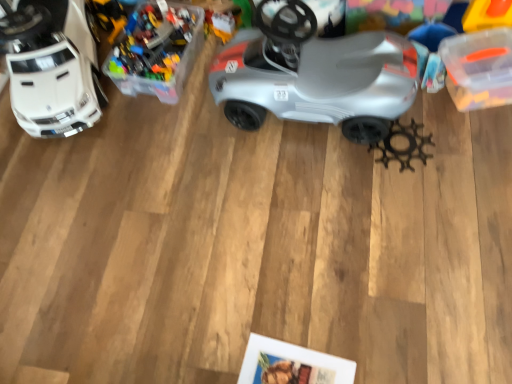
What do you see at coordinates (52, 67) in the screenshot? This screenshot has width=512, height=384. I see `white plastic car at left, the 3th toy in the right-to-left sequence` at bounding box center [52, 67].

What is the approximate height of silver matte car at center?

silver matte car at center is 18.83 inches in height.

The width and height of the screenshot is (512, 384). What do you see at coordinates (157, 51) in the screenshot?
I see `translucent plastic container at upper left, acting as the second toy starting from the left` at bounding box center [157, 51].

Locate an element on the screen. metallic gear at lower right, which is the 1th toy in right-to-left order is located at coordinates (406, 147).

Locate an element on the screen. The width and height of the screenshot is (512, 384). white plastic car at left, the 1th toy when ordered from left to right is located at coordinates (52, 67).

Which is in front, point (180, 70) or point (242, 68)?

Point (242, 68)

This screenshot has height=384, width=512. Identify the location of car above the translucent plastic container at upper left, the 2th toy positioned from the right (from a real-world perspective). [315, 74].

In terms of height, does translucent plastic container at upper left, acting as the second toy starting from the left, look taller or shorter compared to silver matte car at center?

In the image, translucent plastic container at upper left, acting as the second toy starting from the left, appears to be shorter than silver matte car at center.

Who is more distant, translucent plastic container at upper left, the 2th toy positioned from the right, or silver matte car at center?

translucent plastic container at upper left, the 2th toy positioned from the right, is further away from the camera.

Considering the relative positions of translucent plastic container at upper left, the 2th toy positioned from the right, and white plastic car at left, the 3th toy in the right-to-left sequence, in the image provided, is translucent plastic container at upper left, the 2th toy positioned from the right, behind white plastic car at left, the 3th toy in the right-to-left sequence,?

Yes.

Is translucent plastic container at upper left, acting as the second toy starting from the left, oriented away from white plastic car at left, the 3th toy in the right-to-left sequence?

translucent plastic container at upper left, acting as the second toy starting from the left, does not have its back to white plastic car at left, the 3th toy in the right-to-left sequence.

Is translucent plastic container at upper left, the 2th toy positioned from the right, placed right next to white plastic car at left, the 3th toy in the right-to-left sequence?

They are not placed beside each other.

From the picture: Considering the relative sizes of white plastic car at left, the 3th toy in the right-to-left sequence, and translucent plastic container at upper left, acting as the second toy starting from the left, in the image provided, is white plastic car at left, the 3th toy in the right-to-left sequence, shorter than translucent plastic container at upper left, acting as the second toy starting from the left,?

No.

From the image's perspective, who appears lower, white plastic car at left, the 1th toy when ordered from left to right, or translucent plastic container at upper left, acting as the second toy starting from the left?

From the image's view, white plastic car at left, the 1th toy when ordered from left to right, is below.

How different are the orientations of white plastic car at left, the 1th toy when ordered from left to right, and translucent plastic container at upper left, acting as the second toy starting from the left, in degrees?

21.9 degrees separate the facing orientations of white plastic car at left, the 1th toy when ordered from left to right, and translucent plastic container at upper left, acting as the second toy starting from the left.

How far apart are white plastic car at left, the 3th toy in the right-to-left sequence, and translucent plastic container at upper left, the 2th toy positioned from the right?

white plastic car at left, the 3th toy in the right-to-left sequence, is 9.90 inches away from translucent plastic container at upper left, the 2th toy positioned from the right.

Which object is positioned more to the right, white plastic car at left, the 1th toy when ordered from left to right, or metallic gear at lower right, which is the 1th toy in right-to-left order?

metallic gear at lower right, which is the 1th toy in right-to-left order.

Would you say white plastic car at left, the 3th toy in the right-to-left sequence, is outside metallic gear at lower right, the 3th toy viewed from the left?

Absolutely, white plastic car at left, the 3th toy in the right-to-left sequence, is external to metallic gear at lower right, the 3th toy viewed from the left.

Is white plastic car at left, the 1th toy when ordered from left to right, beside metallic gear at lower right, which is the 1th toy in right-to-left order?

No, white plastic car at left, the 1th toy when ordered from left to right, is not making contact with metallic gear at lower right, which is the 1th toy in right-to-left order.

Considering the points (55, 84) and (385, 151), which point is in front, point (55, 84) or point (385, 151)?

The point (55, 84) is in front.

From a real-world perspective, which toy is the 1st one above the metallic gear at lower right, the 3th toy viewed from the left? Please provide its 2D coordinates.

[(157, 51)]

Which object is thinner, translucent plastic container at upper left, the 2th toy positioned from the right, or metallic gear at lower right, which is the 1th toy in right-to-left order?

With smaller width is metallic gear at lower right, which is the 1th toy in right-to-left order.

From the image's perspective, does translucent plastic container at upper left, acting as the second toy starting from the left, appear higher than metallic gear at lower right, the 3th toy viewed from the left?

Correct, translucent plastic container at upper left, acting as the second toy starting from the left, appears higher than metallic gear at lower right, the 3th toy viewed from the left, in the image.

Looking at this image, from a real-world perspective, is translucent plastic container at upper left, acting as the second toy starting from the left, on metallic gear at lower right, the 3th toy viewed from the left?

Yes, from a real-world perspective, translucent plastic container at upper left, acting as the second toy starting from the left, is above metallic gear at lower right, the 3th toy viewed from the left.

From a real-world perspective, between metallic gear at lower right, which is the 1th toy in right-to-left order, and translucent plastic container at upper left, acting as the second toy starting from the left, who is vertically higher?

translucent plastic container at upper left, acting as the second toy starting from the left, from a real-world perspective.

Find the location of a particular element. toy that is the 2nd one when counting upward from the metallic gear at lower right, the 3th toy viewed from the left (from the image's perspective) is located at coordinates (157, 51).

Can you confirm if metallic gear at lower right, the 3th toy viewed from the left, is shorter than translucent plastic container at upper left, acting as the second toy starting from the left?

Yes.

How many degrees apart are the facing directions of metallic gear at lower right, which is the 1th toy in right-to-left order, and translucent plastic container at upper left, the 2th toy positioned from the right?

7.84e-05 degrees separate the facing orientations of metallic gear at lower right, which is the 1th toy in right-to-left order, and translucent plastic container at upper left, the 2th toy positioned from the right.

From a real-world perspective, is silver matte car at center positioned under white plastic car at left, the 3th toy in the right-to-left sequence, based on gravity?

Indeed, from a real-world perspective, silver matte car at center is positioned beneath white plastic car at left, the 3th toy in the right-to-left sequence.

Between point (409, 48) and point (53, 81), which one is positioned in front?

The point (409, 48) is closer.

Is silver matte car at center positioned beyond the bounds of white plastic car at left, the 3th toy in the right-to-left sequence?

That's correct, silver matte car at center is outside of white plastic car at left, the 3th toy in the right-to-left sequence.

Where is `the 2nd toy behind the silver matte car at center, starting your count from the anchor`? the 2nd toy behind the silver matte car at center, starting your count from the anchor is located at coordinates (157, 51).

The image size is (512, 384). In order to click on toy in front of the translucent plastic container at upper left, acting as the second toy starting from the left in this screenshot , I will do coord(52,67).

Based on their spatial positions, is white plastic car at left, the 1th toy when ordered from left to right, or metallic gear at lower right, which is the 1th toy in right-to-left order, further from silver matte car at center?

Based on the image, white plastic car at left, the 1th toy when ordered from left to right, appears to be further to silver matte car at center.

Which object lies further to the anchor point white plastic car at left, the 3th toy in the right-to-left sequence, silver matte car at center or metallic gear at lower right, the 3th toy viewed from the left?

metallic gear at lower right, the 3th toy viewed from the left, is further to white plastic car at left, the 3th toy in the right-to-left sequence.

Which object lies nearer to the anchor point translucent plastic container at upper left, the 2th toy positioned from the right, silver matte car at center or white plastic car at left, the 1th toy when ordered from left to right?

The object closer to translucent plastic container at upper left, the 2th toy positioned from the right, is white plastic car at left, the 1th toy when ordered from left to right.

Considering their positions, is metallic gear at lower right, which is the 1th toy in right-to-left order, positioned further to silver matte car at center than translucent plastic container at upper left, the 2th toy positioned from the right?

translucent plastic container at upper left, the 2th toy positioned from the right, is positioned further to the anchor silver matte car at center.

Estimate the real-world distances between objects in this image. Which object is closer to translucent plastic container at upper left, acting as the second toy starting from the left, white plastic car at left, the 1th toy when ordered from left to right, or silver matte car at center?

Based on the image, white plastic car at left, the 1th toy when ordered from left to right, appears to be nearer to translucent plastic container at upper left, acting as the second toy starting from the left.

Looking at the image, which one is located further to silver matte car at center, white plastic car at left, the 3th toy in the right-to-left sequence, or translucent plastic container at upper left, acting as the second toy starting from the left?

Based on the image, white plastic car at left, the 3th toy in the right-to-left sequence, appears to be further to silver matte car at center.

Estimate the real-world distances between objects in this image. Which object is further from metallic gear at lower right, the 3th toy viewed from the left, silver matte car at center or translucent plastic container at upper left, acting as the second toy starting from the left?

translucent plastic container at upper left, acting as the second toy starting from the left, lies further to metallic gear at lower right, the 3th toy viewed from the left, than the other object.

Considering their positions, is translucent plastic container at upper left, acting as the second toy starting from the left, positioned closer to white plastic car at left, the 1th toy when ordered from left to right, than silver matte car at center?

translucent plastic container at upper left, acting as the second toy starting from the left, is positioned closer to the anchor white plastic car at left, the 1th toy when ordered from left to right.

Image resolution: width=512 pixels, height=384 pixels. I want to click on car between white plastic car at left, the 1th toy when ordered from left to right, and metallic gear at lower right, the 3th toy viewed from the left, in the horizontal direction, so click(x=315, y=74).

The width and height of the screenshot is (512, 384). I want to click on car between translucent plastic container at upper left, acting as the second toy starting from the left, and metallic gear at lower right, which is the 1th toy in right-to-left order, in the horizontal direction, so click(x=315, y=74).

Locate an element on the screen. The image size is (512, 384). toy between white plastic car at left, the 3th toy in the right-to-left sequence, and silver matte car at center is located at coordinates (157, 51).

This screenshot has width=512, height=384. Identify the location of toy between white plastic car at left, the 3th toy in the right-to-left sequence, and metallic gear at lower right, the 3th toy viewed from the left, from left to right. (157, 51).